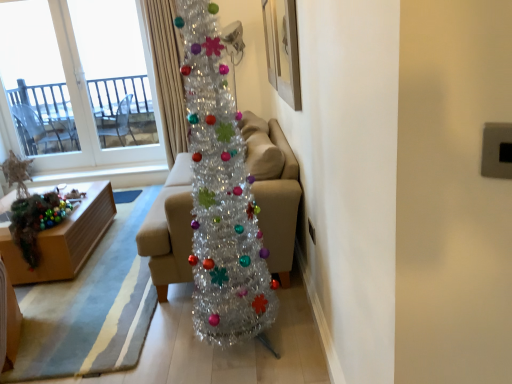
Question: Is shiny metallic christmas tree at center positioned with its back to wooden box at lower left?

Choices:
 (A) no
 (B) yes

Answer: (A)

Question: Is shiny metallic christmas tree at center wider than wooden box at lower left?

Choices:
 (A) yes
 (B) no

Answer: (B)

Question: Is shiny metallic christmas tree at center at the left side of wooden box at lower left?

Choices:
 (A) yes
 (B) no

Answer: (B)

Question: Is wooden box at lower left surrounded by shiny metallic christmas tree at center?

Choices:
 (A) no
 (B) yes

Answer: (A)

Question: Considering the relative positions of shiny metallic christmas tree at center and wooden box at lower left in the image provided, is shiny metallic christmas tree at center to the right of wooden box at lower left from the viewer's perspective?

Choices:
 (A) yes
 (B) no

Answer: (A)

Question: Is shiny metallic christmas tree at center shorter than wooden box at lower left?

Choices:
 (A) no
 (B) yes

Answer: (A)

Question: Is transparent glass window at upper left at the right side of beige fabric couch at center?

Choices:
 (A) no
 (B) yes

Answer: (A)

Question: Is the position of transparent glass window at upper left more distant than that of beige fabric couch at center?

Choices:
 (A) no
 (B) yes

Answer: (B)

Question: Is transparent glass window at upper left far away from beige fabric couch at center?

Choices:
 (A) no
 (B) yes

Answer: (B)

Question: Does transparent glass window at upper left have a greater width compared to beige fabric couch at center?

Choices:
 (A) no
 (B) yes

Answer: (A)

Question: From a real-world perspective, is transparent glass window at upper left on beige fabric couch at center?

Choices:
 (A) no
 (B) yes

Answer: (B)

Question: From a real-world perspective, is transparent glass window at upper left positioned under beige fabric couch at center based on gravity?

Choices:
 (A) yes
 (B) no

Answer: (B)

Question: From the image's perspective, is beige fabric couch at center located beneath wooden picture frame at upper center?

Choices:
 (A) no
 (B) yes

Answer: (B)